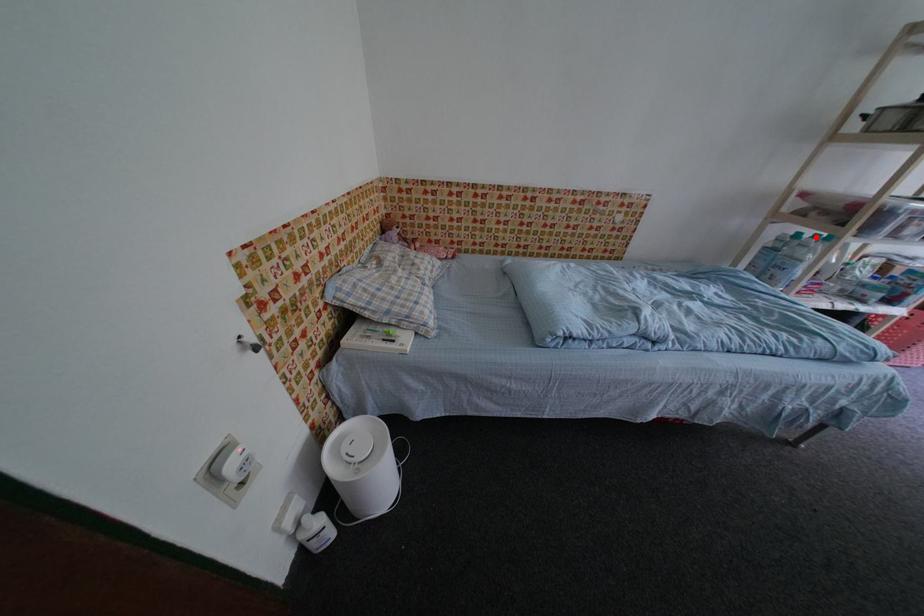
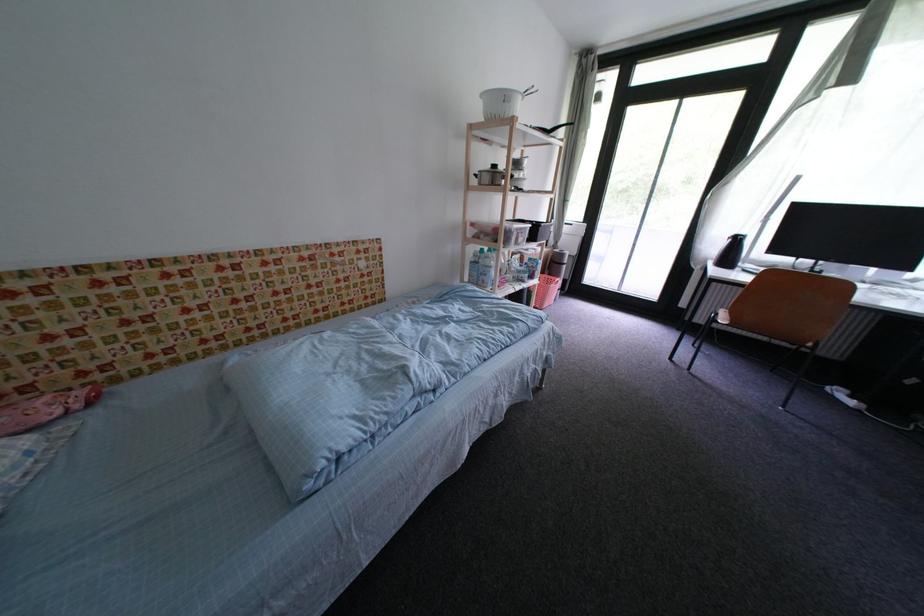
Question: A red point is marked in image1. In image2, is the corresponding 3D point closer to the camera or farther? Reply with the corresponding letter.

Choices:
 (A) The corresponding 3D point is closer.
 (B) The corresponding 3D point is farther.

Answer: (A)